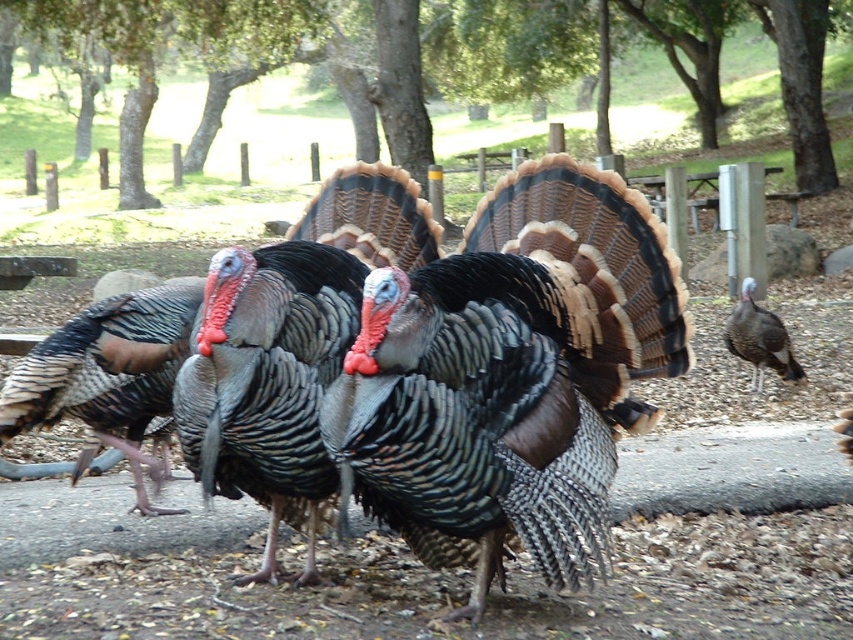
You are a photographer trying to capture the shiny metallic turkey at center in your shot. The camera is set to focus on objects at point 0.6, 0.6. Will the turkey be in focus?

The shiny metallic turkey at center is positioned at point (511, 376), which is very close to the focus point (511, 384). Therefore, the turkey will be in focus.

You are a park visitor who wants to take a photo of the shiny metallic turkey at center and the gray feathered turkey at right. If you want to capture both turkeys in the same frame without moving, which turkey should you focus on first to ensure both are in focus?

You should focus on the gray feathered turkey at right first because the shiny metallic turkey at center is wider, so focusing on the closer object might help keep both in focus.